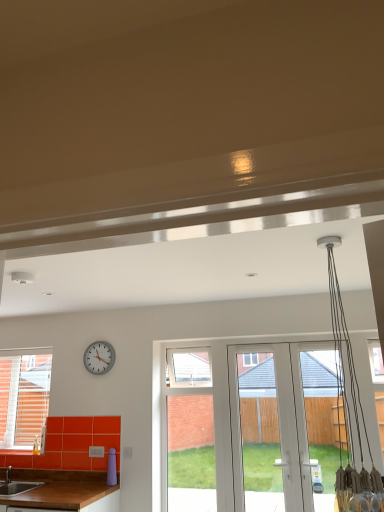
Question: Considering the positions of matte brown sink at lower left and white plastic clock at upper left in the image, is matte brown sink at lower left taller or shorter than white plastic clock at upper left?

Choices:
 (A) tall
 (B) short

Answer: (B)

Question: In the image, is matte brown sink at lower left on the left side or the right side of white plastic clock at upper left?

Choices:
 (A) left
 (B) right

Answer: (A)

Question: Which object is positioned closest to the matte brown sink at lower left?

Choices:
 (A) white plastic clock at upper left
 (B) brown wooden countertop at lower left
 (C) white glossy screen door at center

Answer: (B)

Question: Which object is positioned closest to the brown wooden countertop at lower left?

Choices:
 (A) matte brown sink at lower left
 (B) white plastic clock at upper left
 (C) white glossy screen door at center

Answer: (A)